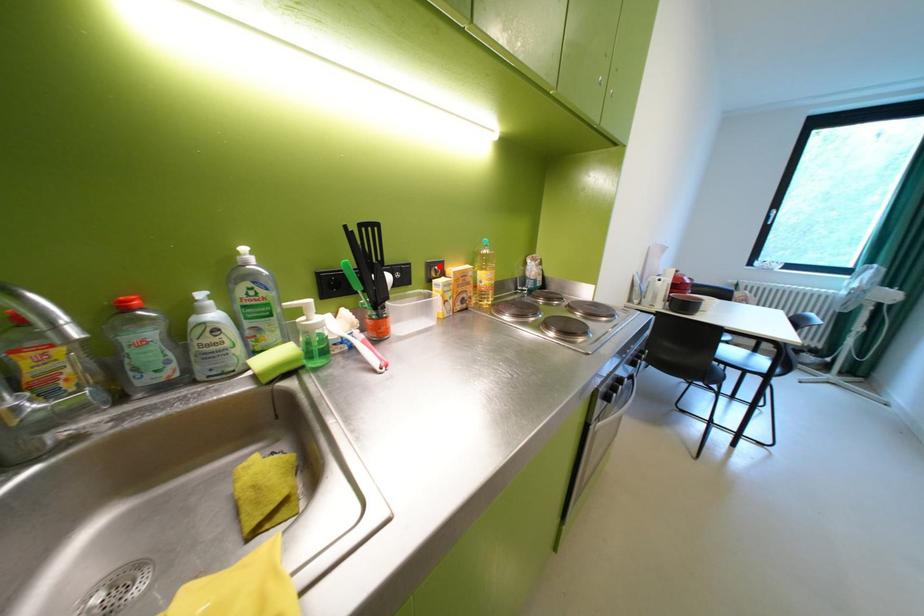
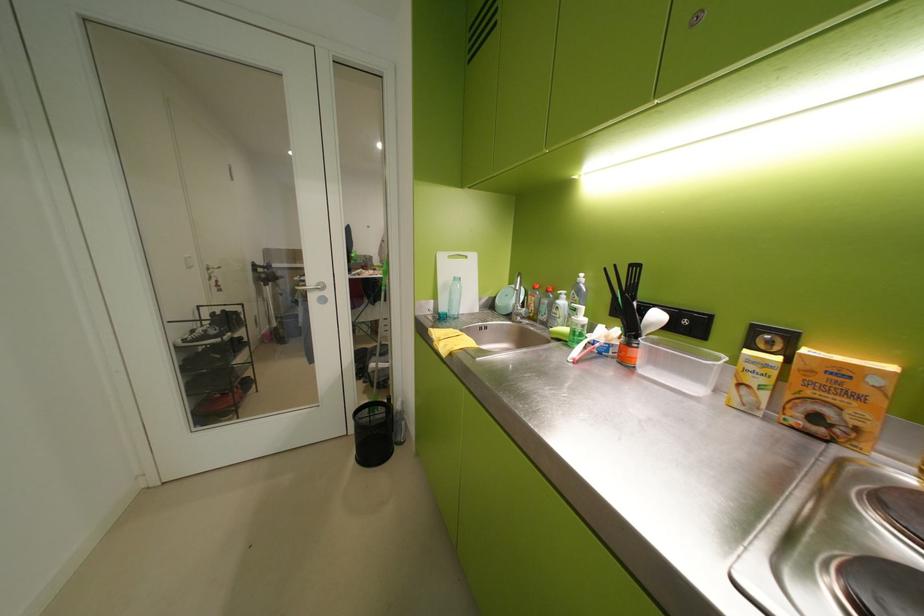
Question: I am providing you with two images of the same scene from different viewpoints. A red point is marked on the first image. Is the red point's position out of view in image 2?

Choices:
 (A) Yes
 (B) No

Answer: (B)